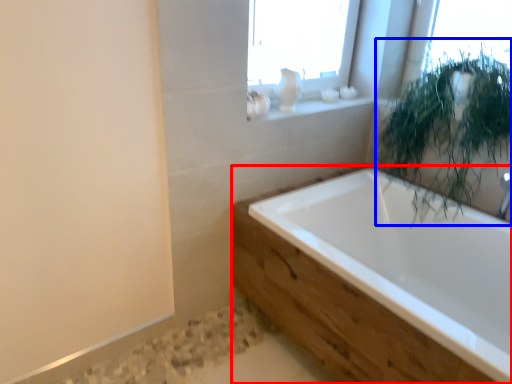
Question: Which object appears closest to the camera in this image, bathtub (highlighted by a red box) or vegetation (highlighted by a blue box)?

Choices:
 (A) bathtub
 (B) vegetation

Answer: (A)